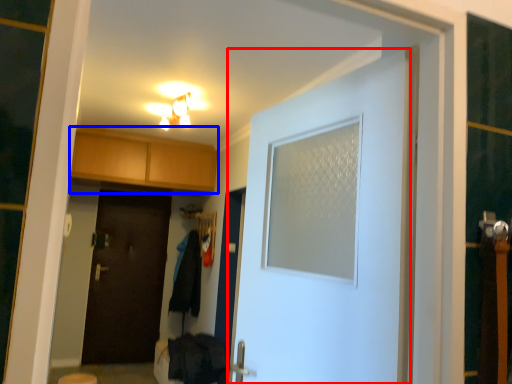
Question: Among these objects, which one is farthest to the camera, door (highlighted by a red box) or cabinetry (highlighted by a blue box)?

Choices:
 (A) door
 (B) cabinetry

Answer: (B)